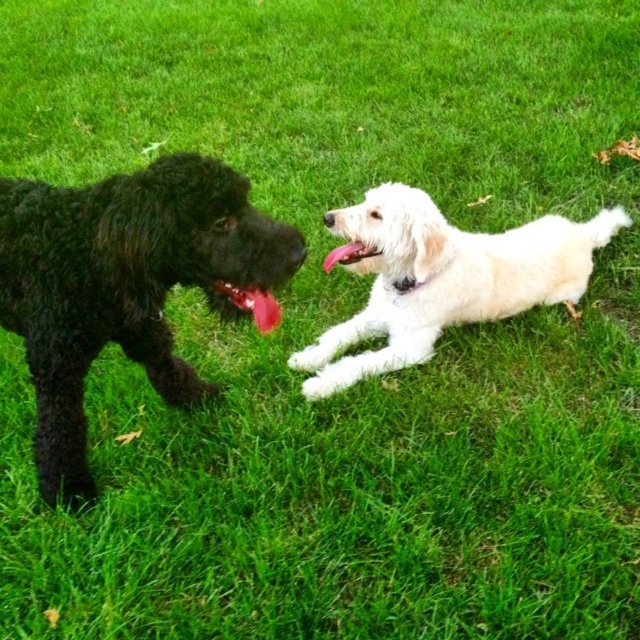
Which is in front, point (3, 323) or point (221, 285)?

Point (221, 285) is in front.

Identify the location of shiny black fur at left. This screenshot has width=640, height=640. [124, 284].

Identify the location of shiny black fur at left. (124, 284).

Looking at this image, does white fluffy dog at center come in front of rubber-like red tongue at center?

No, it is not.

Which is above, white fluffy dog at center or rubber-like red tongue at center?

white fluffy dog at center is above.

Which is behind, point (406, 346) or point (262, 304)?

Positioned behind is point (406, 346).

Image resolution: width=640 pixels, height=640 pixels. I want to click on white fluffy dog at center, so click(x=440, y=278).

Which is above, shiny black fur at left or white fluffy dog at center?

white fluffy dog at center is higher up.

Looking at this image, between shiny black fur at left and white fluffy dog at center, which one has more height?

With more height is shiny black fur at left.

Who is more distant from viewer, (252, 240) or (353, 264)?

Positioned behind is point (353, 264).

The image size is (640, 640). What are the coordinates of `shiny black fur at left` in the screenshot? It's located at (124, 284).